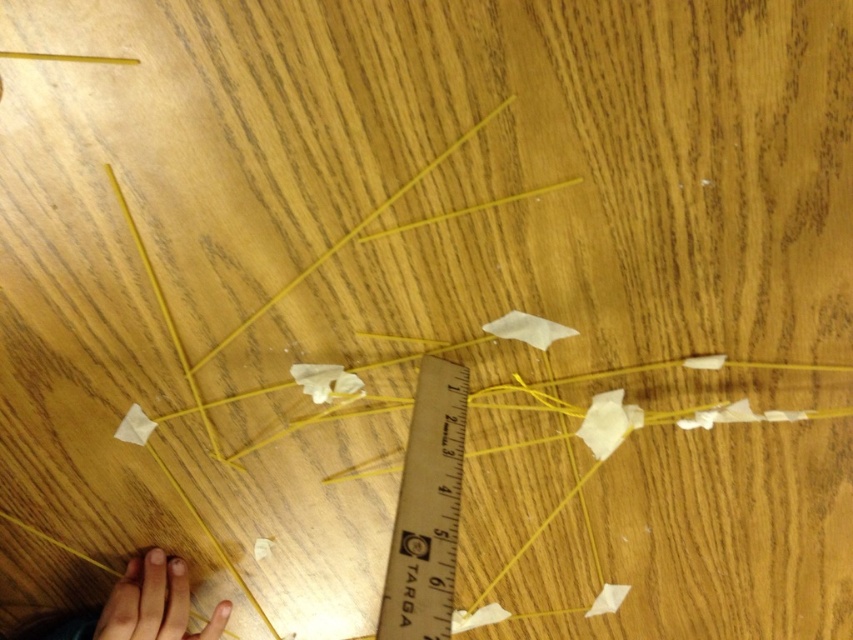
Which is behind, point (428, 536) or point (70, 636)?

The point (70, 636) is more distant.

Can you confirm if wooden ruler at center is taller than smooth skin hand at lower left?

Indeed, wooden ruler at center has a greater height compared to smooth skin hand at lower left.

Is point (444, 584) closer to viewer compared to point (161, 586)?

That is True.

Where is `wooden ruler at center`? Image resolution: width=853 pixels, height=640 pixels. wooden ruler at center is located at coordinates (427, 509).